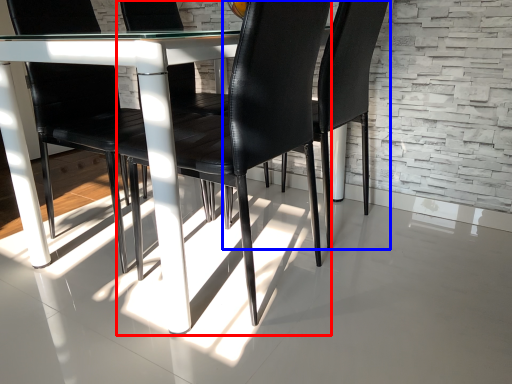
Question: Among these objects, which one is nearest to the camera, chair (highlighted by a red box) or chair (highlighted by a blue box)?

Choices:
 (A) chair
 (B) chair

Answer: (A)